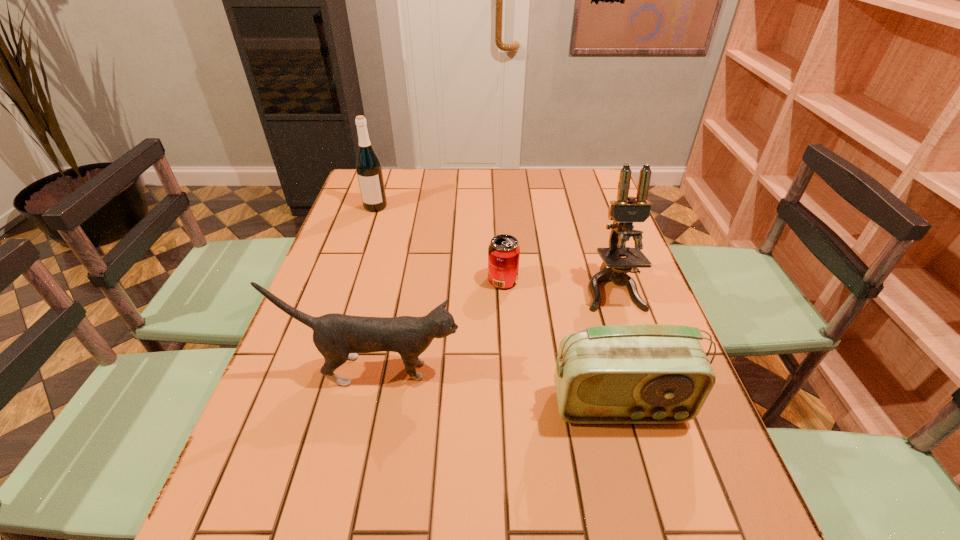
Find the location of `vacant area that lies between the shortest object and the microscope`. vacant area that lies between the shortest object and the microscope is located at coordinates (558, 284).

This screenshot has height=540, width=960. Identify the location of free spot between the cat and the radio receiver. (497, 388).

You are a GUI agent. You are given a task and a screenshot of the screen. Output one action in this format:
    pyautogui.click(x=<x>, y=<y>)
    Task: Click on the object that is the fourth closest to the radio receiver
    
    Given the screenshot: What is the action you would take?
    pyautogui.click(x=369, y=171)

Where is `the third closest object to the microscope`? the third closest object to the microscope is located at coordinates (338, 337).

At what (x,y) coordinates should I click in order to perform the action: click on vacant position in the image that satisfies the following two spatial constraints: 1. at the eyepieces of the microscope; 2. at the face of the cat. Please return your answer as a coordinate pair (x, y). The height and width of the screenshot is (540, 960). Looking at the image, I should click on (639, 370).

Image resolution: width=960 pixels, height=540 pixels. Find the location of `free space that satisfies the following two spatial constraints: 1. on the label of the shortest object; 2. on the right side of the wine bottle`. free space that satisfies the following two spatial constraints: 1. on the label of the shortest object; 2. on the right side of the wine bottle is located at coordinates (351, 280).